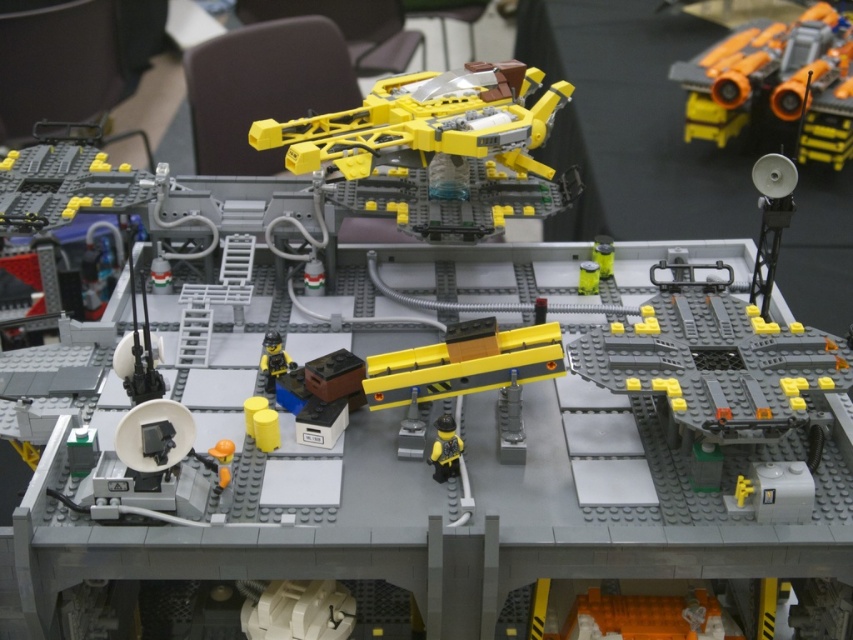
You are a maintenance technician on the LEGO space station and need to retrieve an orange plastic toy at upper right that is blocking a sensor. The maximum reach of your extendable tool is 6 feet. Can you safely retrieve it without moving closer?

The orange plastic toy at upper right is 6.05 feet from the camera, which is slightly beyond the 6 feet reach of your tool. Therefore, you cannot safely retrieve it without moving closer.

You are an astronaut on a spacewalk near the LEGO space station. You notice the orange plastic toy at upper right and the yellow matte figure at center. Which object would appear larger to you from your current position?

The orange plastic toy at upper right is bigger than the yellow matte figure at center, so it would appear larger to you from your current position.